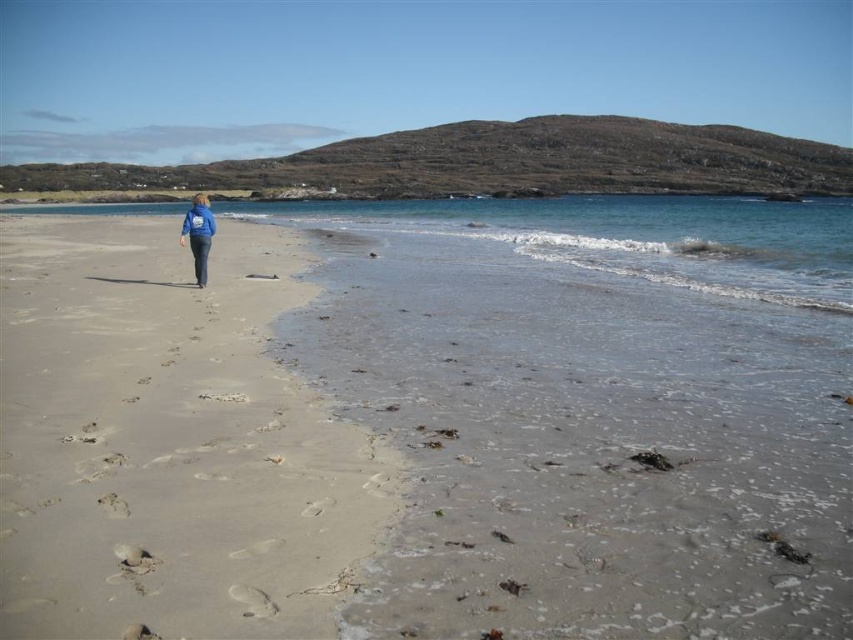
Question: Considering the relative positions of light beige sand at left and blue fabric jacket at center in the image provided, where is light beige sand at left located with respect to blue fabric jacket at center?

Choices:
 (A) above
 (B) below

Answer: (B)

Question: From the image, what is the correct spatial relationship of light beige sand at left in relation to blue fabric jacket at center?

Choices:
 (A) right
 (B) left

Answer: (A)

Question: Does light beige sand at left lie in front of blue fabric jacket at center?

Choices:
 (A) yes
 (B) no

Answer: (A)